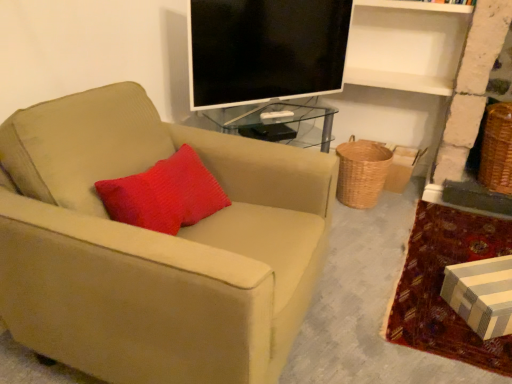
Question: Is black glossy tv at upper center further to camera compared to striped cardboard box at lower right?

Choices:
 (A) no
 (B) yes

Answer: (B)

Question: From a real-world perspective, does black glossy tv at upper center stand above striped cardboard box at lower right?

Choices:
 (A) yes
 (B) no

Answer: (A)

Question: Is black glossy tv at upper center to the left of striped cardboard box at lower right from the viewer's perspective?

Choices:
 (A) yes
 (B) no

Answer: (A)

Question: Considering the relative positions of black glossy tv at upper center and striped cardboard box at lower right in the image provided, is black glossy tv at upper center to the right of striped cardboard box at lower right from the viewer's perspective?

Choices:
 (A) no
 (B) yes

Answer: (A)

Question: Is black glossy tv at upper center oriented away from striped cardboard box at lower right?

Choices:
 (A) yes
 (B) no

Answer: (B)

Question: From a real-world perspective, is black glossy tv at upper center located beneath striped cardboard box at lower right?

Choices:
 (A) yes
 (B) no

Answer: (B)

Question: From a real-world perspective, is striped cardboard box at lower right physically above black glossy tv at upper center?

Choices:
 (A) yes
 (B) no

Answer: (B)

Question: Considering the relative positions of striped cardboard box at lower right and black glossy tv at upper center in the image provided, is striped cardboard box at lower right in front of black glossy tv at upper center?

Choices:
 (A) yes
 (B) no

Answer: (A)

Question: Can you confirm if striped cardboard box at lower right is thinner than black glossy tv at upper center?

Choices:
 (A) no
 (B) yes

Answer: (A)

Question: Can you confirm if striped cardboard box at lower right is bigger than black glossy tv at upper center?

Choices:
 (A) no
 (B) yes

Answer: (A)

Question: Considering the relative sizes of striped cardboard box at lower right and black glossy tv at upper center in the image provided, is striped cardboard box at lower right wider than black glossy tv at upper center?

Choices:
 (A) no
 (B) yes

Answer: (B)

Question: Is striped cardboard box at lower right facing away from black glossy tv at upper center?

Choices:
 (A) yes
 (B) no

Answer: (B)

Question: Considering the relative positions of woven brown basket at lower right, the first basket viewed from the left, and black glossy tv at upper center in the image provided, is woven brown basket at lower right, the first basket viewed from the left, to the left of black glossy tv at upper center from the viewer's perspective?

Choices:
 (A) no
 (B) yes

Answer: (A)